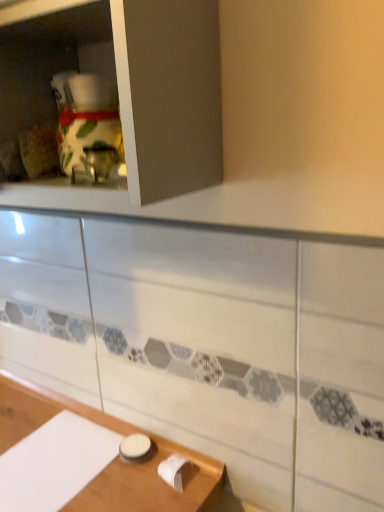
Question: Based on their sizes in the image, would you say white glossy jar at lower center is bigger or smaller than white glossy cabinet at upper left?

Choices:
 (A) small
 (B) big

Answer: (A)

Question: Considering the relative positions of white glossy jar at lower center and white glossy cabinet at upper left in the image provided, is white glossy jar at lower center to the left or to the right of white glossy cabinet at upper left?

Choices:
 (A) left
 (B) right

Answer: (B)

Question: Is white glossy jar at lower center situated inside white glossy cabinet at upper left or outside?

Choices:
 (A) outside
 (B) inside

Answer: (A)

Question: From the image's perspective, is white glossy cabinet at upper left located above or below white glossy jar at lower center?

Choices:
 (A) above
 (B) below

Answer: (A)

Question: From their relative heights in the image, would you say white glossy cabinet at upper left is taller or shorter than white glossy jar at lower center?

Choices:
 (A) short
 (B) tall

Answer: (B)

Question: Relative to white glossy jar at lower center, is white glossy cabinet at upper left in front or behind?

Choices:
 (A) behind
 (B) front

Answer: (B)

Question: Looking at their shapes, would you say white glossy cabinet at upper left is wider or thinner than white glossy jar at lower center?

Choices:
 (A) thin
 (B) wide

Answer: (B)